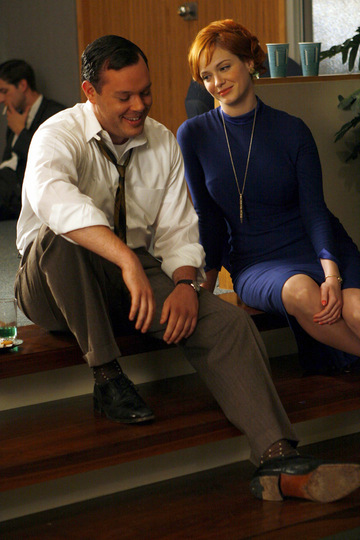
This screenshot has height=540, width=360. Identify the location of man's socks. (113, 369), (279, 446).